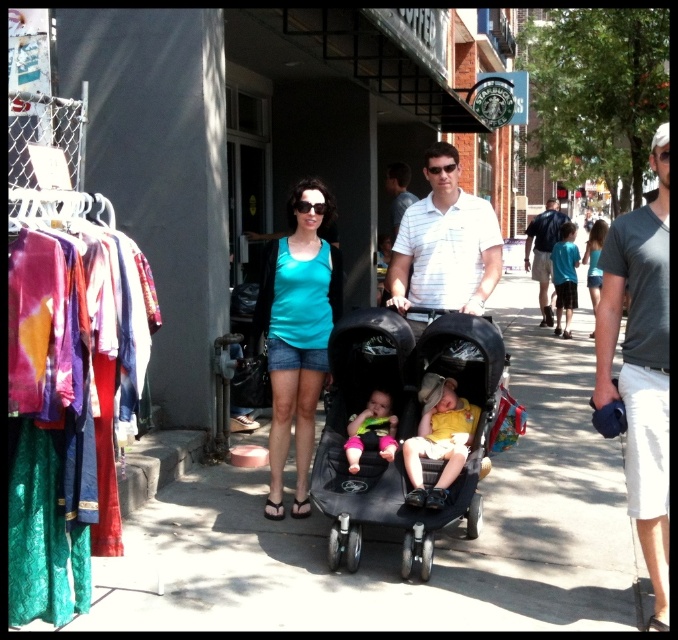
Question: Is black matte stroller at center behind soft pink fabric baby at center?

Choices:
 (A) yes
 (B) no

Answer: (B)

Question: Can you confirm if white striped shirt at center is thinner than yellow cotton shirt at center?

Choices:
 (A) no
 (B) yes

Answer: (A)

Question: Is matte teal tank top at center closer to the viewer compared to soft pink fabric baby at center?

Choices:
 (A) no
 (B) yes

Answer: (A)

Question: Which point is farther to the camera?

Choices:
 (A) smooth concrete pavement at center
 (B) soft pink fabric baby at center

Answer: (B)

Question: Which point is farther to the camera?

Choices:
 (A) (395, 172)
 (B) (363, 445)
 (C) (426, 499)

Answer: (A)

Question: Which point is closer to the camera?

Choices:
 (A) (374, 499)
 (B) (605, 273)

Answer: (B)